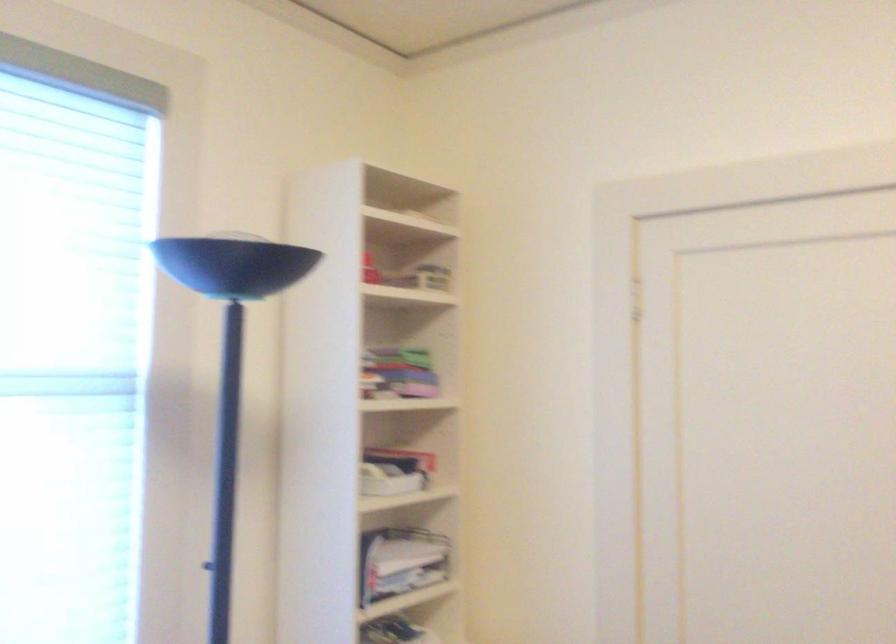
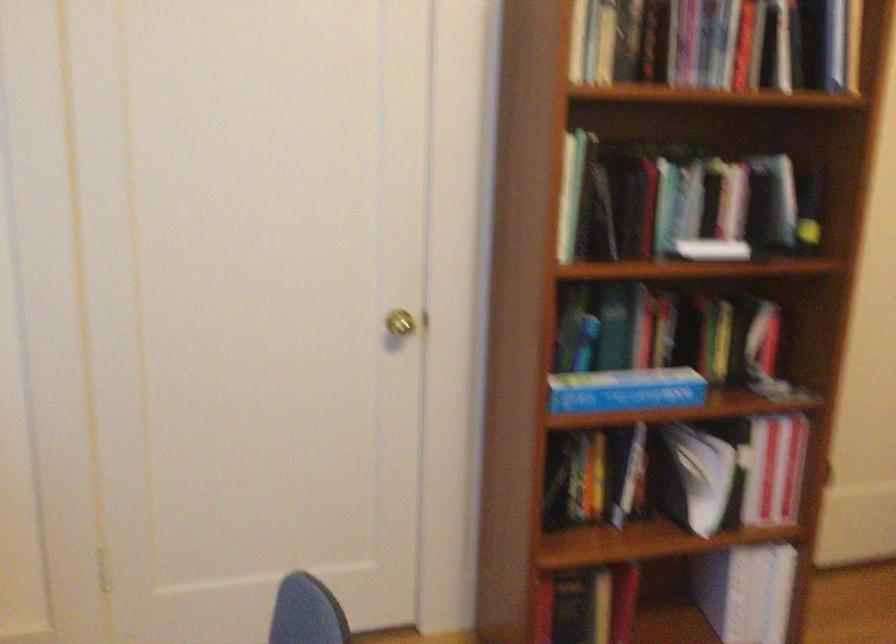
Based on the continuous images, in which direction is the camera rotating?

The rotation direction of the camera is right-down.